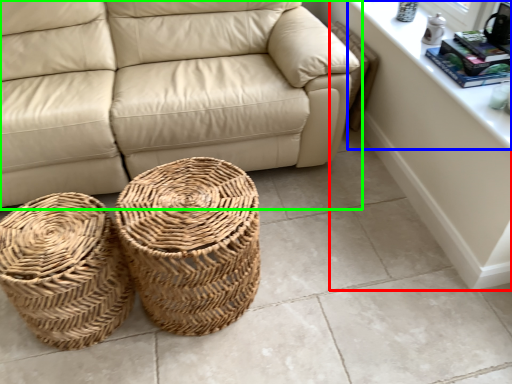
Question: Considering the real-world distances, which object is farthest from dresser (highlighted by a red box)? window sill (highlighted by a blue box) or studio couch (highlighted by a green box)?

Choices:
 (A) window sill
 (B) studio couch

Answer: (B)